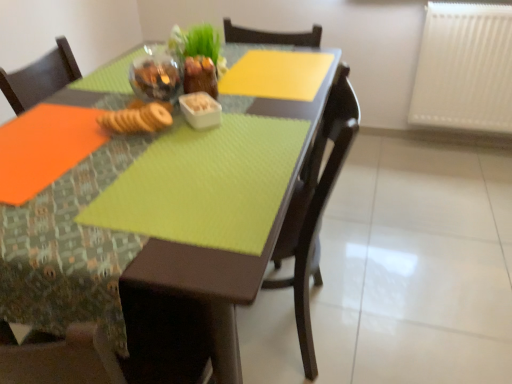
Image resolution: width=512 pixels, height=384 pixels. I want to click on free location in front of brown crumbly biscuit at center, so click(x=106, y=165).